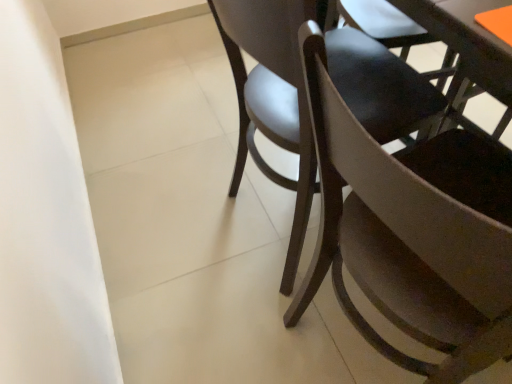
Question: Is matte black chair at center, arranged as the 1th chair when viewed from the top, spatially inside matte brown chair at center, the 2th chair in the top-to-bottom sequence, or outside of it?

Choices:
 (A) inside
 (B) outside

Answer: (B)

Question: From the image's perspective, is matte black chair at center, which is the second chair from bottom to top, positioned above or below matte brown chair at center, the 2th chair in the top-to-bottom sequence?

Choices:
 (A) below
 (B) above

Answer: (B)

Question: Looking at the image, does matte black chair at center, which is the second chair from bottom to top, seem bigger or smaller compared to matte brown chair at center, the 2th chair in the top-to-bottom sequence?

Choices:
 (A) big
 (B) small

Answer: (A)

Question: In the image, is matte brown chair at center, which is the 1th chair from bottom to top, on the left side or the right side of matte black chair at center, which is the second chair from bottom to top?

Choices:
 (A) left
 (B) right

Answer: (B)

Question: From a real-world perspective, is matte brown chair at center, which is the 1th chair from bottom to top, physically located above or below matte black chair at center, which is the second chair from bottom to top?

Choices:
 (A) below
 (B) above

Answer: (B)

Question: From the image's perspective, is matte brown chair at center, the 2th chair in the top-to-bottom sequence, located above or below matte black chair at center, arranged as the 1th chair when viewed from the top?

Choices:
 (A) below
 (B) above

Answer: (A)

Question: Looking at their shapes, would you say matte brown chair at center, the 2th chair in the top-to-bottom sequence, is wider or thinner than matte black chair at center, which is the second chair from bottom to top?

Choices:
 (A) thin
 (B) wide

Answer: (A)